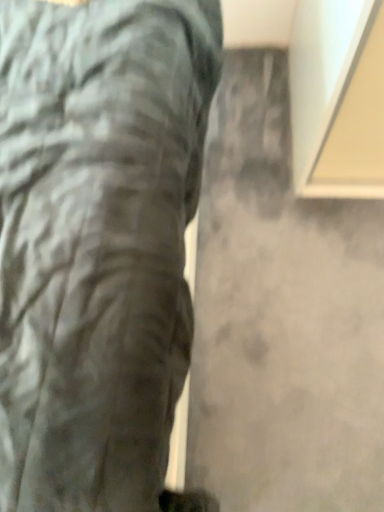
Question: Relative to matte gray trousers at center, is gray matte concrete at center in front or behind?

Choices:
 (A) front
 (B) behind

Answer: (B)

Question: Based on their sizes in the image, would you say gray matte concrete at center is bigger or smaller than matte gray trousers at center?

Choices:
 (A) big
 (B) small

Answer: (B)

Question: From the image's perspective, relative to matte gray trousers at center, is gray matte concrete at center above or below?

Choices:
 (A) above
 (B) below

Answer: (B)

Question: Considering the positions of matte gray trousers at center and gray matte concrete at center in the image, is matte gray trousers at center wider or thinner than gray matte concrete at center?

Choices:
 (A) wide
 (B) thin

Answer: (A)

Question: Would you say matte gray trousers at center is to the left or to the right of gray matte concrete at center in the picture?

Choices:
 (A) right
 (B) left

Answer: (B)

Question: From a real-world perspective, is matte gray trousers at center positioned above or below gray matte concrete at center?

Choices:
 (A) above
 (B) below

Answer: (A)

Question: Is point (188, 190) positioned closer to the camera than point (365, 266)?

Choices:
 (A) closer
 (B) farther

Answer: (A)